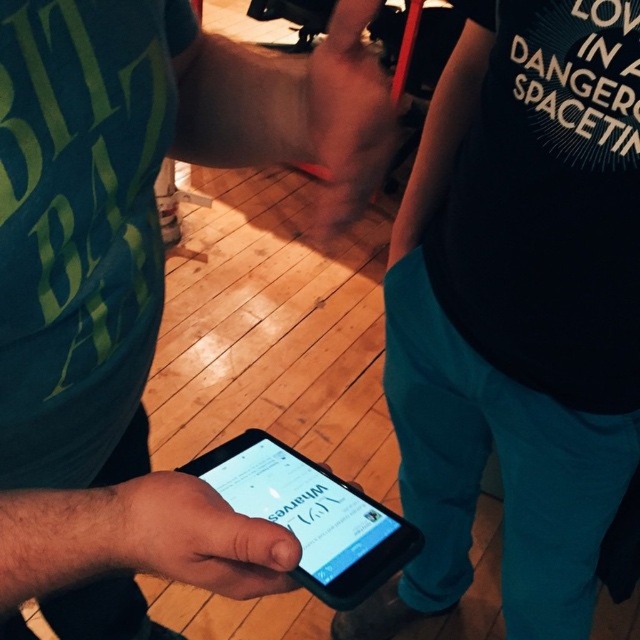
Which is below, black matte shirt at center or black matte phone at center?

Positioned lower is black matte shirt at center.

Is point (552, 438) positioned after point (147, 536)?

Yes, point (552, 438) is farther from viewer.

Is point (465, 468) positioned before point (173, 573)?

No, it is behind (173, 573).

You are a GUI agent. You are given a task and a screenshot of the screen. Output one action in this format:
    pyautogui.click(x=<x>, y=<y>)
    Task: Click on the black matte shirt at center
    This screenshot has height=640, width=640.
    Given the screenshot: What is the action you would take?
    pyautogui.click(x=516, y=310)

Between point (396, 531) and point (360, 188), which one is positioned behind?

The point (396, 531) is behind.

Which is more to the right, black matte smartphone at lower center or matte skin hand at center?

matte skin hand at center is more to the right.

Who is more forward, [355,568] or [330,113]?

Point [330,113] is in front.

Where is `black matte smartphone at lower center`? The height and width of the screenshot is (640, 640). black matte smartphone at lower center is located at coordinates (310, 515).

The width and height of the screenshot is (640, 640). What do you see at coordinates (131, 282) in the screenshot?
I see `matte black phone at lower center` at bounding box center [131, 282].

Where is `matte black phone at lower center`? matte black phone at lower center is located at coordinates (131, 282).

Find the location of a particular element. This screenshot has width=640, height=640. matte black phone at lower center is located at coordinates (131, 282).